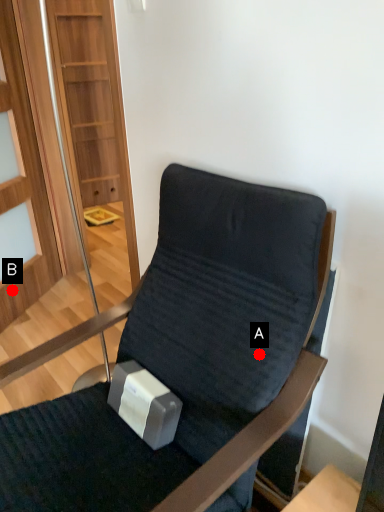
Question: Two points are circled on the image, labeled by A and B beside each circle. Which point is farther from the camera taking this photo?

Choices:
 (A) A is further
 (B) B is further

Answer: (B)